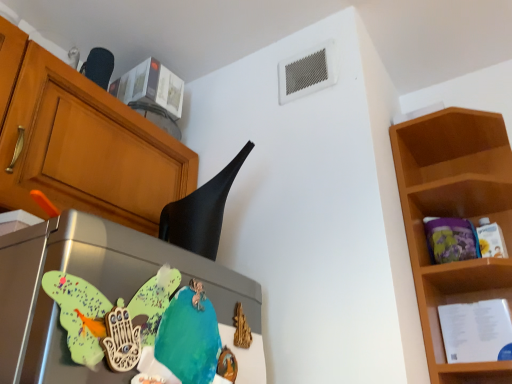
Question: Relative to metallic refrigerator at center-left, is black matte exhaust hood at upper center in front or behind?

Choices:
 (A) front
 (B) behind

Answer: (B)

Question: From a real-world perspective, relative to metallic refrigerator at center-left, is black matte exhaust hood at upper center vertically above or below?

Choices:
 (A) above
 (B) below

Answer: (A)

Question: Which object is positioned farthest from the black matte exhaust hood at upper center?

Choices:
 (A) wooden shelf at right
 (B) metallic refrigerator at center-left

Answer: (A)

Question: Estimate the real-world distances between objects in this image. Which object is closer to the wooden shelf at right?

Choices:
 (A) metallic refrigerator at center-left
 (B) black matte exhaust hood at upper center

Answer: (B)